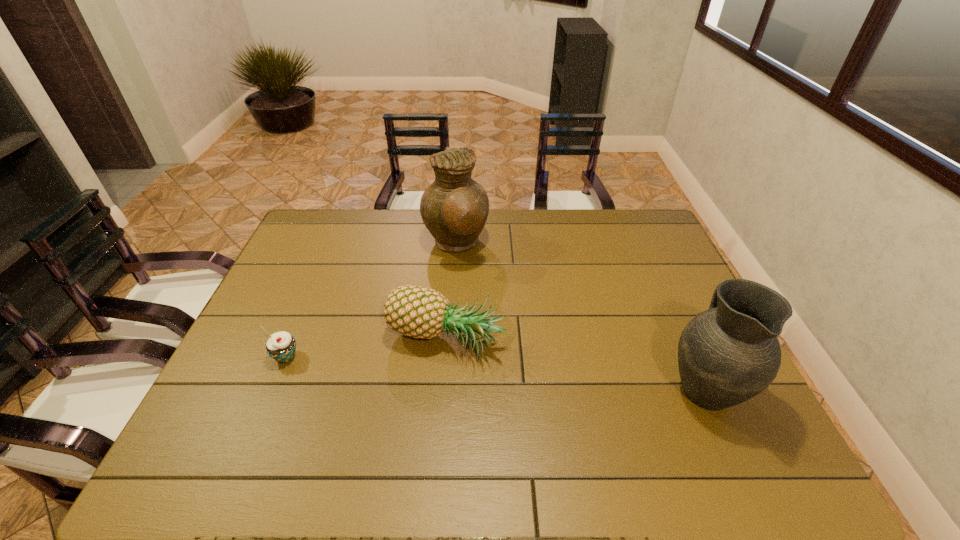
Find the location of a particular element. This screenshot has width=960, height=540. the farthest object is located at coordinates (454, 208).

This screenshot has height=540, width=960. Identify the location of the farther pitcher. (454, 208).

This screenshot has height=540, width=960. In order to click on the nearer pitcher in this screenshot , I will do `click(728, 354)`.

Identify the location of the right pitcher. The image size is (960, 540). (728, 354).

Where is `pineapple`? pineapple is located at coordinates (414, 311).

At what (x,y) coordinates should I click in order to perform the action: click on cupcake. Please return your answer as a coordinate pair (x, y). Looking at the image, I should click on (281, 346).

I want to click on the shortest object, so click(281, 346).

This screenshot has width=960, height=540. I want to click on free space located at the spout of the farther pitcher, so click(x=590, y=244).

You are a GUI agent. You are given a task and a screenshot of the screen. Output one action in this format:
    pyautogui.click(x=<x>, y=<y>)
    Task: Click on the free point located 0.050m on the side of the right pitcher with the handle
    
    Given the screenshot: What is the action you would take?
    pyautogui.click(x=683, y=339)

I want to click on vacant region located on the side of the right pitcher with the handle, so click(x=679, y=330).